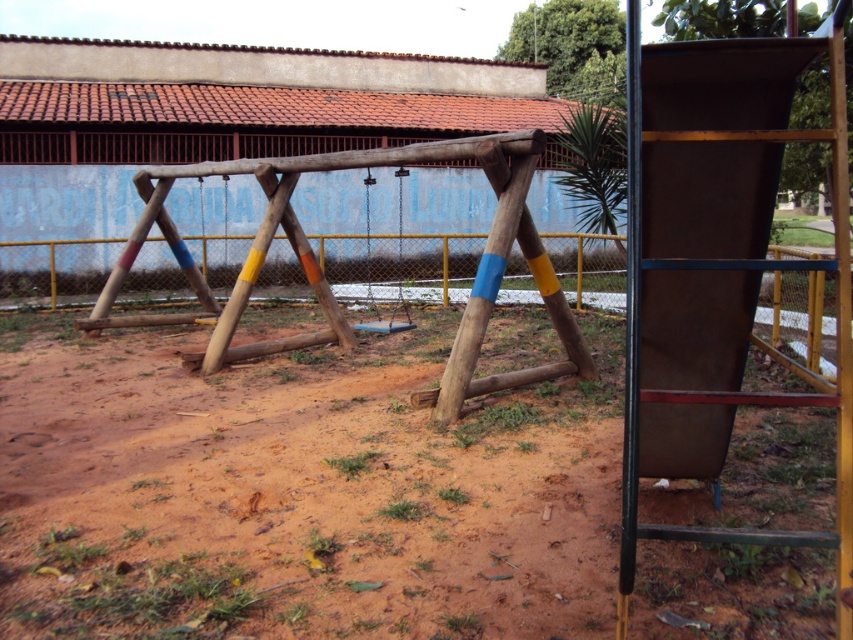
Question: Is brown matte ladder at right bigger than blue matte swing at center?

Choices:
 (A) no
 (B) yes

Answer: (A)

Question: Does brown dirt field at center appear on the left side of brown matte ladder at right?

Choices:
 (A) yes
 (B) no

Answer: (B)

Question: Estimate the real-world distances between objects in this image. Which object is farther from the brown dirt field at center?

Choices:
 (A) blue matte swing at center
 (B) brown matte ladder at right

Answer: (A)

Question: Which object appears closest to the camera in this image?

Choices:
 (A) brown matte ladder at right
 (B) brown dirt field at center

Answer: (A)

Question: Does brown matte ladder at right lie in front of blue matte swing at center?

Choices:
 (A) no
 (B) yes

Answer: (B)

Question: Which point is closer to the camera taking this photo?

Choices:
 (A) (398, 276)
 (B) (635, 436)
 (C) (608, 358)

Answer: (B)